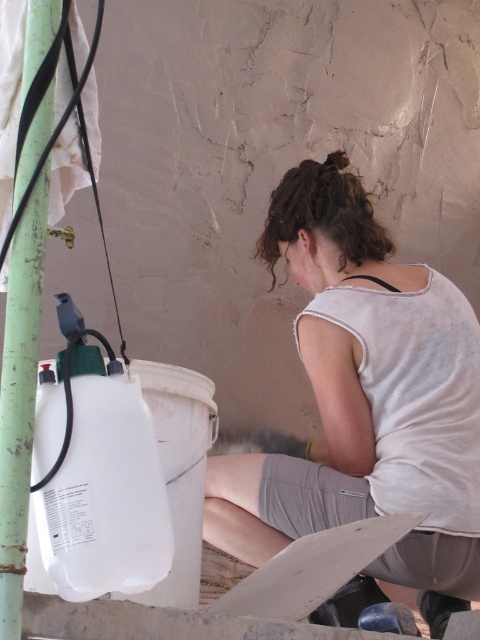
Who is higher up, white matte tank top at center or green painted metal pole at left?

Positioned higher is green painted metal pole at left.

This screenshot has width=480, height=640. Identify the location of white matte tank top at center. (363, 397).

Where is `white matte tank top at center`? white matte tank top at center is located at coordinates (363, 397).